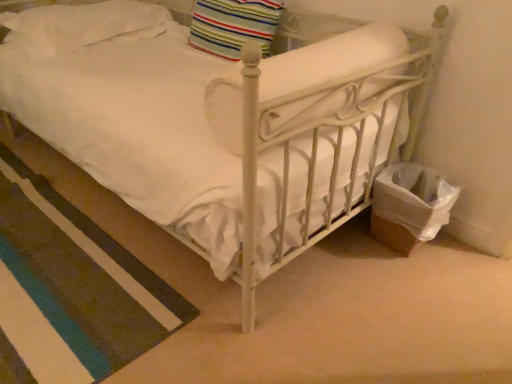
Question: Does white soft rug at lower left have a greater height compared to white soft pillow at upper left, which is counted as the second pillow, starting from the right?

Choices:
 (A) yes
 (B) no

Answer: (B)

Question: Is white soft rug at lower left to the left of white soft pillow at upper left, marked as the first pillow in a left-to-right arrangement, from the viewer's perspective?

Choices:
 (A) no
 (B) yes

Answer: (B)

Question: Are white soft rug at lower left and white soft pillow at upper left, which is counted as the second pillow, starting from the right, making contact?

Choices:
 (A) yes
 (B) no

Answer: (B)

Question: Does white soft rug at lower left appear on the right side of white soft pillow at upper left, marked as the first pillow in a left-to-right arrangement?

Choices:
 (A) yes
 (B) no

Answer: (B)

Question: Is white soft rug at lower left positioned before white soft pillow at upper left, which is counted as the second pillow, starting from the right?

Choices:
 (A) yes
 (B) no

Answer: (A)

Question: Considering the relative sizes of white soft rug at lower left and white soft pillow at upper left, marked as the first pillow in a left-to-right arrangement, in the image provided, is white soft rug at lower left smaller than white soft pillow at upper left, marked as the first pillow in a left-to-right arrangement,?

Choices:
 (A) yes
 (B) no

Answer: (A)

Question: Considering the relative sizes of striped fabric pillow at upper center, placed as the first pillow when sorted from right to left, and white soft rug at lower left in the image provided, is striped fabric pillow at upper center, placed as the first pillow when sorted from right to left, thinner than white soft rug at lower left?

Choices:
 (A) yes
 (B) no

Answer: (A)

Question: From a real-world perspective, is striped fabric pillow at upper center, placed as the first pillow when sorted from right to left, under white soft rug at lower left?

Choices:
 (A) no
 (B) yes

Answer: (A)

Question: Considering the relative sizes of striped fabric pillow at upper center, the 2th pillow positioned from the left, and white soft rug at lower left in the image provided, is striped fabric pillow at upper center, the 2th pillow positioned from the left, taller than white soft rug at lower left?

Choices:
 (A) yes
 (B) no

Answer: (A)

Question: Is striped fabric pillow at upper center, the 2th pillow positioned from the left, next to white soft rug at lower left and touching it?

Choices:
 (A) no
 (B) yes

Answer: (A)

Question: Does striped fabric pillow at upper center, the 2th pillow positioned from the left, lie behind white soft rug at lower left?

Choices:
 (A) no
 (B) yes

Answer: (B)

Question: Considering the relative sizes of striped fabric pillow at upper center, the 2th pillow positioned from the left, and white soft rug at lower left in the image provided, is striped fabric pillow at upper center, the 2th pillow positioned from the left, shorter than white soft rug at lower left?

Choices:
 (A) yes
 (B) no

Answer: (B)

Question: From a real-world perspective, is white soft rug at lower left on top of striped fabric pillow at upper center, placed as the first pillow when sorted from right to left?

Choices:
 (A) no
 (B) yes

Answer: (A)